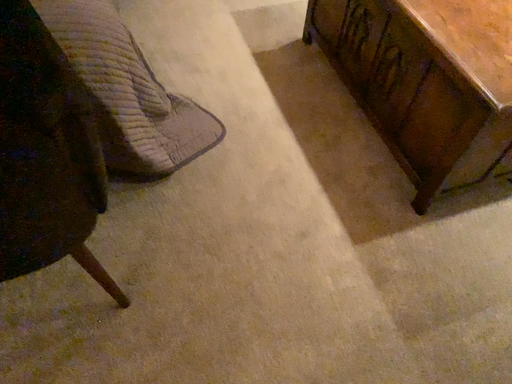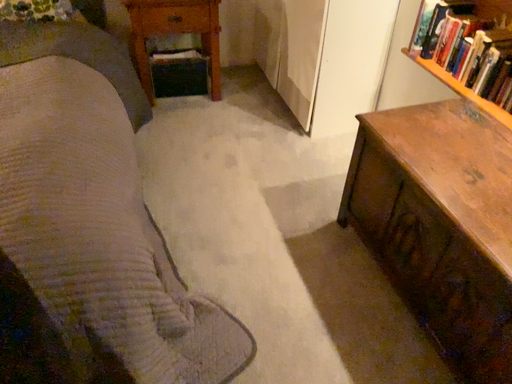
Question: How did the camera likely rotate when shooting the video?

Choices:
 (A) rotated upward
 (B) rotated downward

Answer: (A)